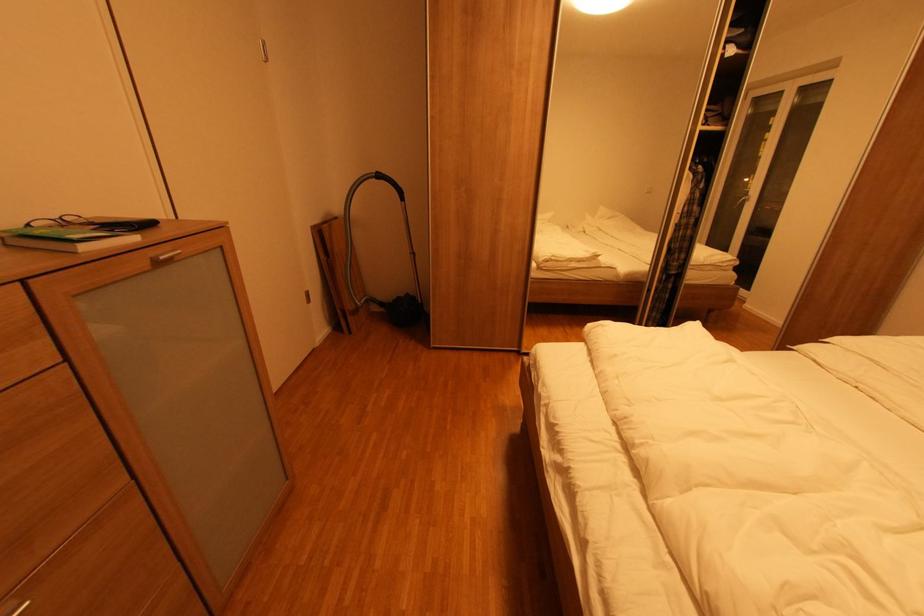
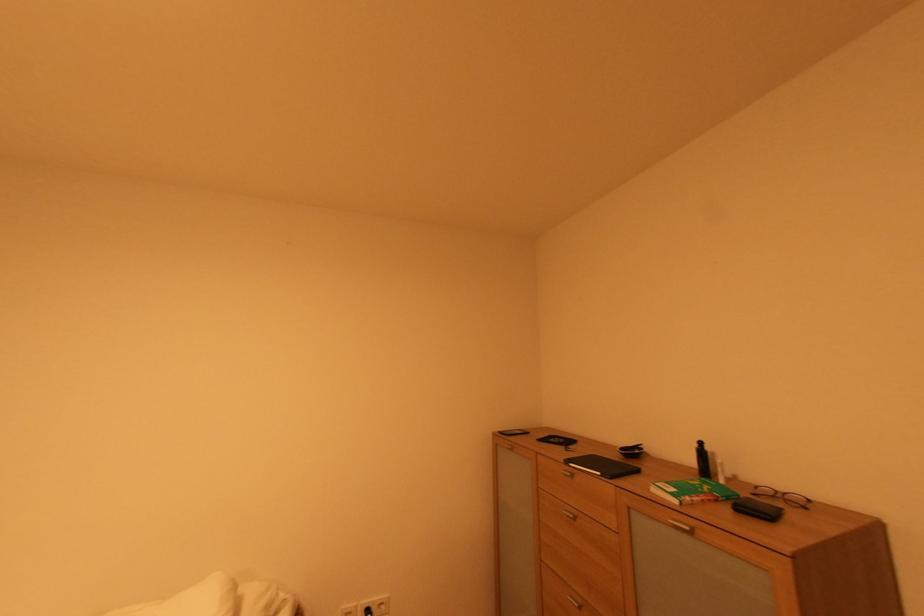
Find the pixel in the second image that matches (x=187, y=253) in the first image.

(694, 530)